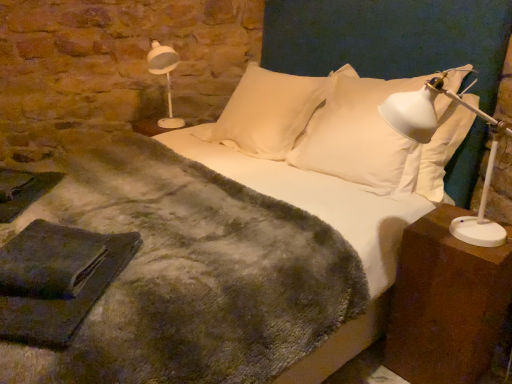
Question: From the image's perspective, is white soft pillow at center, the first pillow from the left, on white plastic table lamp at right?

Choices:
 (A) yes
 (B) no

Answer: (A)

Question: From the image's perspective, is white soft pillow at center, acting as the 2th pillow starting from the right, under white plastic table lamp at right?

Choices:
 (A) no
 (B) yes

Answer: (A)

Question: Does white soft pillow at center, acting as the 2th pillow starting from the right, have a greater width compared to white plastic table lamp at right?

Choices:
 (A) yes
 (B) no

Answer: (B)

Question: Does white soft pillow at center, acting as the 2th pillow starting from the right, have a larger size compared to white plastic table lamp at right?

Choices:
 (A) no
 (B) yes

Answer: (B)

Question: Does white soft pillow at center, acting as the 2th pillow starting from the right, appear on the left side of white plastic table lamp at right?

Choices:
 (A) no
 (B) yes

Answer: (B)

Question: Would you say brown wooden nightstand at right is to the left or to the right of white soft pillow at upper center, which is the 1th pillow in right-to-left order, in the picture?

Choices:
 (A) left
 (B) right

Answer: (B)

Question: Is point (422, 316) positioned closer to the camera than point (352, 81)?

Choices:
 (A) farther
 (B) closer

Answer: (B)

Question: From a real-world perspective, is brown wooden nightstand at right physically located above or below white soft pillow at upper center, which is the 1th pillow in right-to-left order?

Choices:
 (A) below
 (B) above

Answer: (A)

Question: In terms of size, does brown wooden nightstand at right appear bigger or smaller than white soft pillow at upper center, which is the 1th pillow in right-to-left order?

Choices:
 (A) big
 (B) small

Answer: (B)

Question: Would you say white plastic lamp at upper left is inside or outside white plastic table lamp at right?

Choices:
 (A) inside
 (B) outside

Answer: (B)

Question: From the image's perspective, is white plastic lamp at upper left located above or below white plastic table lamp at right?

Choices:
 (A) below
 (B) above

Answer: (B)

Question: From a real-world perspective, is white plastic lamp at upper left physically located above or below white plastic table lamp at right?

Choices:
 (A) below
 (B) above

Answer: (A)

Question: Relative to white plastic table lamp at right, is white plastic lamp at upper left in front or behind?

Choices:
 (A) front
 (B) behind

Answer: (B)

Question: Is white soft pillow at center, acting as the 2th pillow starting from the right, wider or thinner than white plastic table lamp at right?

Choices:
 (A) wide
 (B) thin

Answer: (B)

Question: Considering the positions of white soft pillow at center, acting as the 2th pillow starting from the right, and white plastic table lamp at right in the image, is white soft pillow at center, acting as the 2th pillow starting from the right, bigger or smaller than white plastic table lamp at right?

Choices:
 (A) big
 (B) small

Answer: (A)